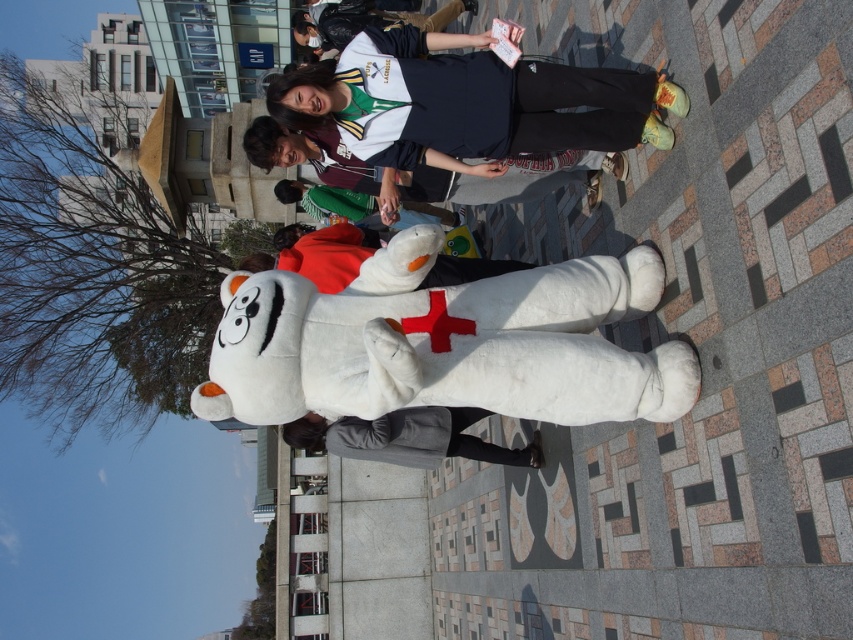
Does white plush bear at center have a lesser height compared to gray fleece jacket at lower center?

Yes, white plush bear at center is shorter than gray fleece jacket at lower center.

Between white plush bear at center and gray fleece jacket at lower center, which one is positioned higher?

white plush bear at center is higher up.

This screenshot has height=640, width=853. In order to click on white plush bear at center in this screenshot , I will do `click(445, 342)`.

Identify the location of white plush bear at center. (445, 342).

Can you confirm if white plush bear at center is bigger than matte white jacket at center?

Actually, white plush bear at center might be smaller than matte white jacket at center.

Describe the element at coordinates (445, 342) in the screenshot. I see `white plush bear at center` at that location.

This screenshot has height=640, width=853. I want to click on white plush bear at center, so click(x=445, y=342).

Who is lower down, matte white jacket at center or gray fleece jacket at lower center?

gray fleece jacket at lower center is below.

Between matte white jacket at center and gray fleece jacket at lower center, which one appears on the right side from the viewer's perspective?

gray fleece jacket at lower center

Does point (577, 156) lie behind point (364, 440)?

No, it is not.

In order to click on matte white jacket at center in this screenshot , I will do `click(509, 177)`.